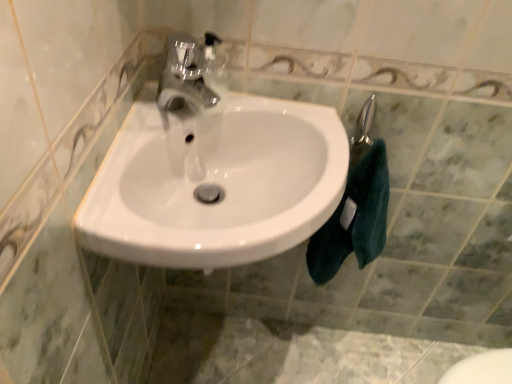
Question: Is dark teal towel at right inside the boundaries of white glossy sink at center, or outside?

Choices:
 (A) outside
 (B) inside

Answer: (A)

Question: From a real-world perspective, is dark teal towel at right positioned above or below white glossy sink at center?

Choices:
 (A) above
 (B) below

Answer: (B)

Question: In the image, is dark teal towel at right positioned in front of or behind white glossy sink at center?

Choices:
 (A) behind
 (B) front

Answer: (A)

Question: From a real-world perspective, is white glossy sink at center physically located above or below dark teal towel at right?

Choices:
 (A) below
 (B) above

Answer: (B)

Question: Considering their positions, is white glossy sink at center located in front of or behind dark teal towel at right?

Choices:
 (A) front
 (B) behind

Answer: (A)

Question: In terms of height, does white glossy sink at center look taller or shorter compared to dark teal towel at right?

Choices:
 (A) tall
 (B) short

Answer: (B)

Question: Considering the relative positions of white glossy sink at center and dark teal towel at right in the image provided, is white glossy sink at center to the left or to the right of dark teal towel at right?

Choices:
 (A) right
 (B) left

Answer: (B)